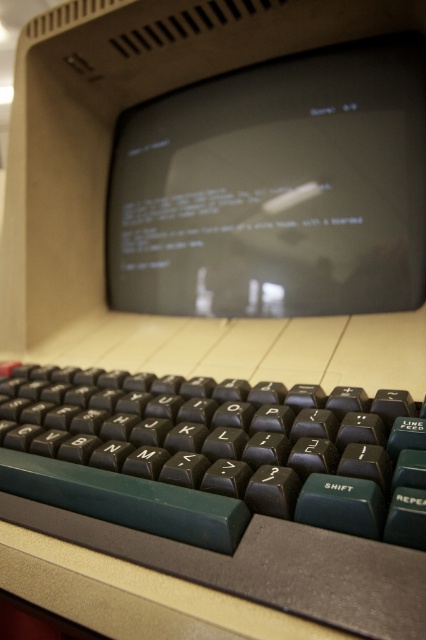
Is black plastic keyboard at lower center positioned behind matte black monitor at center?

No.

Between point (23, 417) and point (275, 108), which one is positioned in front?

Point (23, 417)

At what (x,y) coordinates should I click in order to perform the action: click on black plastic keyboard at lower center. Please return your answer as a coordinate pair (x, y). Looking at the image, I should click on (229, 484).